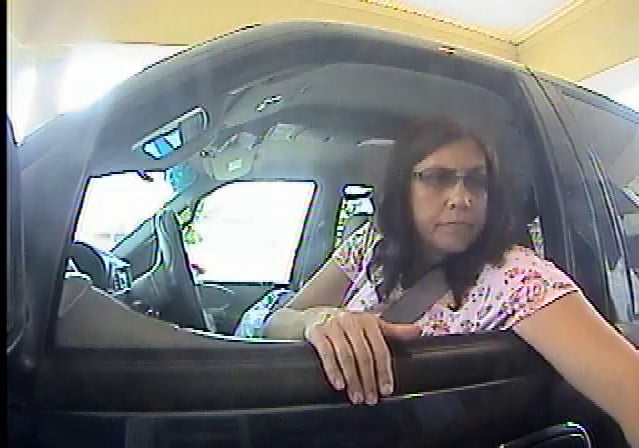
The width and height of the screenshot is (639, 448). I want to click on mirror, so click(163, 145).